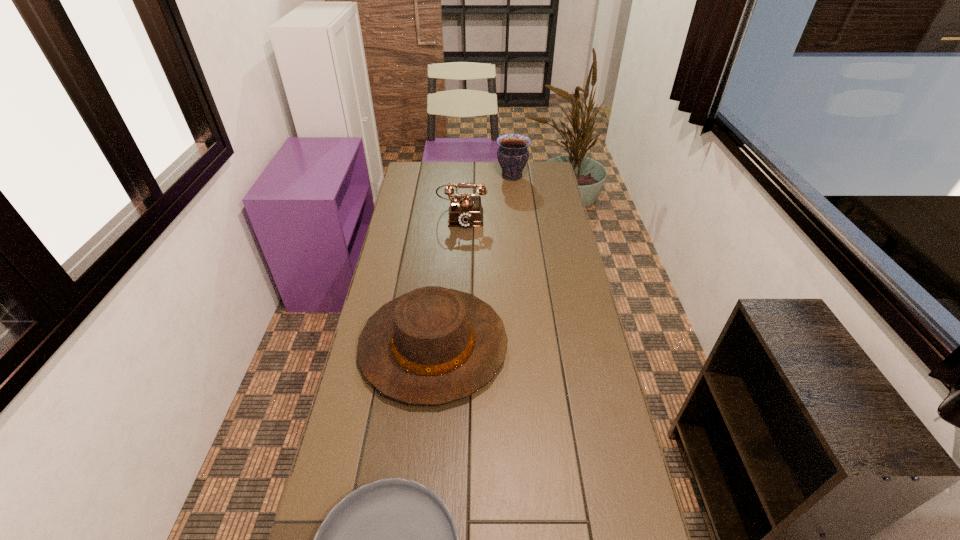
Locate an element on the screen. free spot between the second farthest object and the pottery is located at coordinates (487, 196).

In order to click on object that can be found as the third closest to the second farthest object in this screenshot , I will do `click(394, 539)`.

Identify which object is the closest to the cowboy hat. Please provide its 2D coordinates. Your answer should be formatted as a tuple, i.e. [(x, y)], where the tuple contains the x and y coordinates of a point satisfying the conditions above.

[(394, 539)]

Where is `free location that satisfies the following two spatial constraints: 1. on the front handle of the farthest object; 2. on the front side of the second nearest object`? This screenshot has width=960, height=540. free location that satisfies the following two spatial constraints: 1. on the front handle of the farthest object; 2. on the front side of the second nearest object is located at coordinates (530, 345).

I want to click on vacant area that satisfies the following two spatial constraints: 1. on the front handle of the pottery; 2. on the front side of the cowboy hat, so click(530, 345).

In order to click on vacant space that satisfies the following two spatial constraints: 1. on the front handle of the farthest object; 2. on the dial of the telephone in this screenshot , I will do `click(516, 215)`.